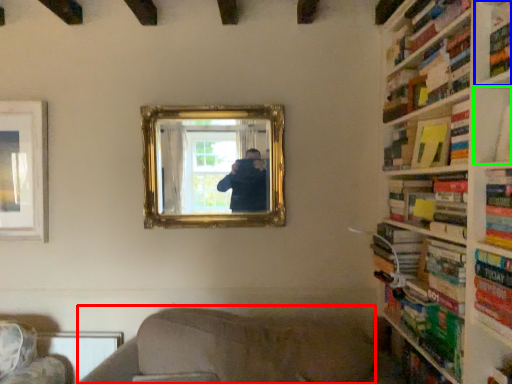
Question: Which object is the farthest from couch (highlighted by a red box)? Choose among these: shelf (highlighted by a blue box) or shelf (highlighted by a green box).

Choices:
 (A) shelf
 (B) shelf

Answer: (A)